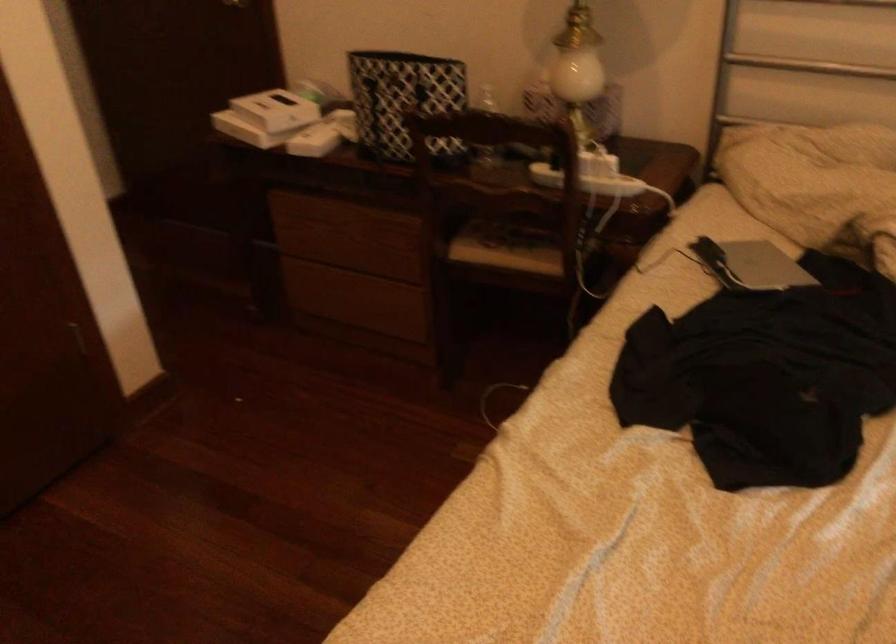
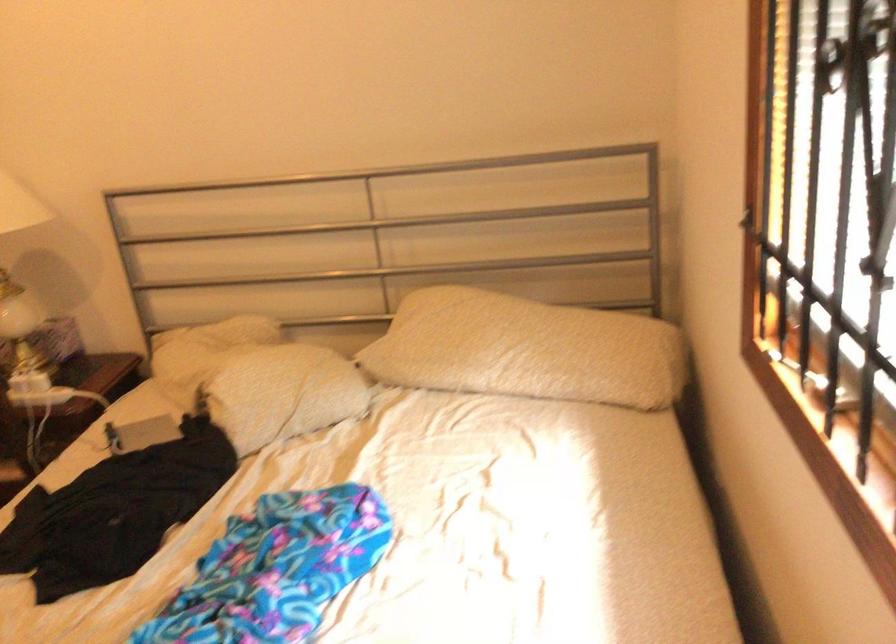
Question: The camera is either moving clockwise (left) or counter-clockwise (right) around the object. The first image is from the beginning of the video and the second image is from the end. Is the camera moving left or right when shooting the video?

Choices:
 (A) Left
 (B) Right

Answer: (A)